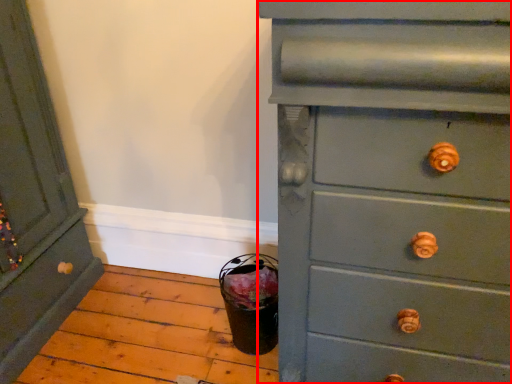
Question: From the image's perspective, where is chest of drawers (annotated by the red box) located relative to chest of drawers?

Choices:
 (A) above
 (B) below

Answer: (B)